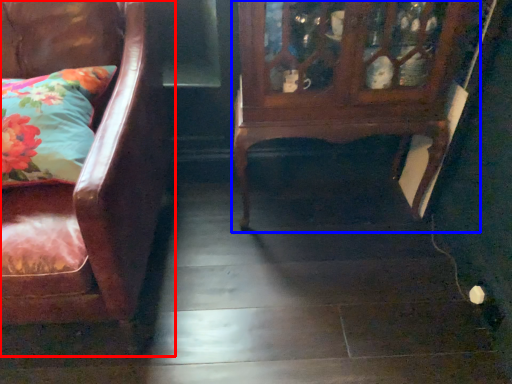
Question: Which of the following is the farthest to the observer, chair (highlighted by a red box) or furniture (highlighted by a blue box)?

Choices:
 (A) chair
 (B) furniture

Answer: (B)